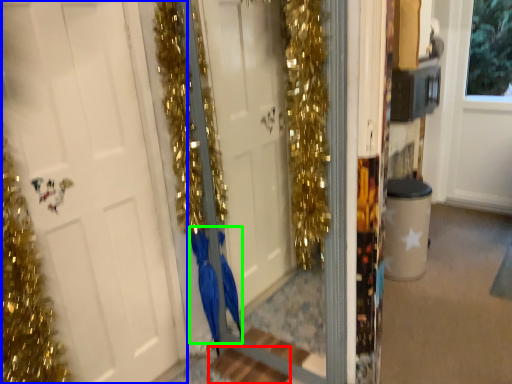
Question: Considering the real-world distances, which object is closest to stair (highlighted by a red box)? door (highlighted by a blue box) or dress (highlighted by a green box).

Choices:
 (A) door
 (B) dress

Answer: (B)